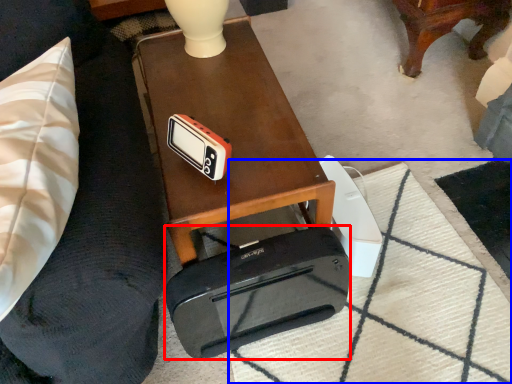
Question: Which of the following is the farthest to the observer, cassette (highlighted by a red box) or mat (highlighted by a blue box)?

Choices:
 (A) cassette
 (B) mat

Answer: (B)